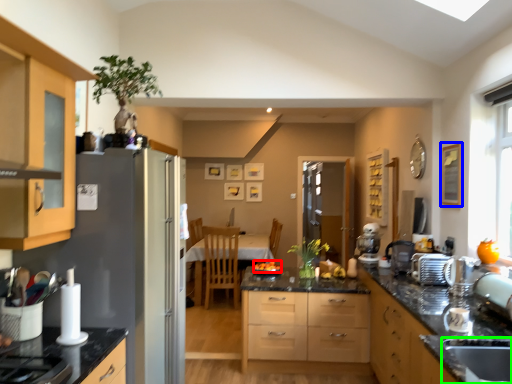
Question: Estimate the real-world distances between objects in this image. Which object is farther from fruit (highlighted by a red box), picture frame (highlighted by a blue box) or sink (highlighted by a green box)?

Choices:
 (A) picture frame
 (B) sink

Answer: (B)